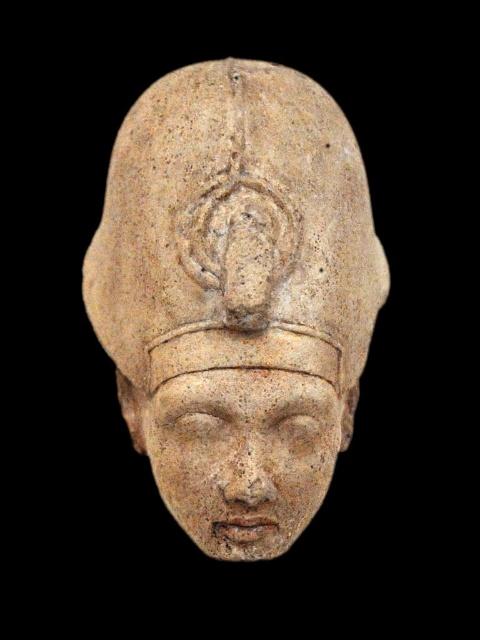
Between beige stone head at center and matte stone face at center, which one is positioned higher?

Positioned higher is beige stone head at center.

Can you confirm if beige stone head at center is positioned below matte stone face at center?

No, beige stone head at center is not below matte stone face at center.

Is point (298, 509) behind point (315, 500)?

No.

Where is `beige stone head at center`? beige stone head at center is located at coordinates (237, 296).